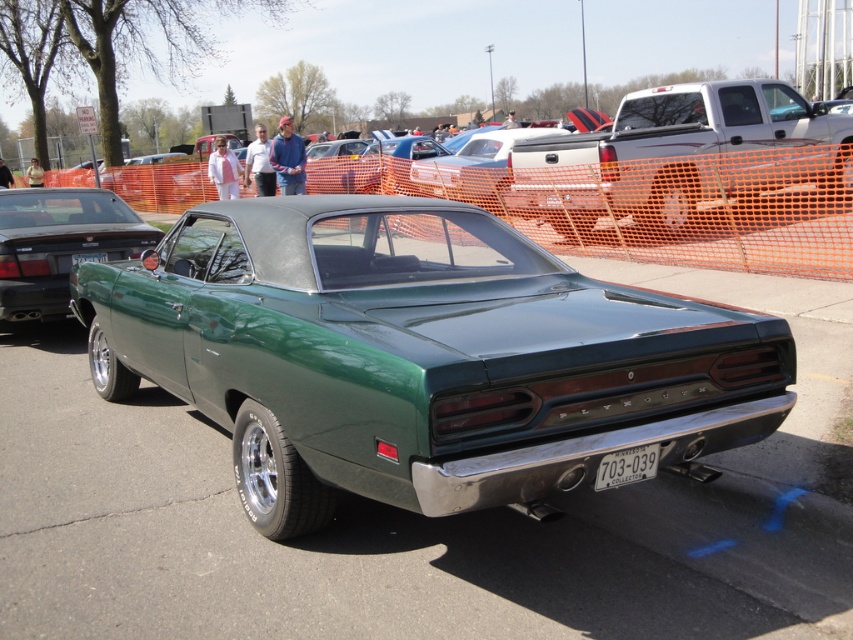
Between green glossy car at center and silver metallic pickup truck at upper right, which one has more height?

green glossy car at center

Which is above, green glossy car at center or silver metallic pickup truck at upper right?

silver metallic pickup truck at upper right is above.

Measure the distance between green glossy car at center and camera.

green glossy car at center is 8.52 feet away from camera.

The width and height of the screenshot is (853, 640). I want to click on green glossy car at center, so pos(418,355).

Does green glossy car at center lie behind green matte car at center?

No, it is in front of green matte car at center.

Image resolution: width=853 pixels, height=640 pixels. I want to click on green glossy car at center, so click(x=418, y=355).

Locate an element on the screen. The height and width of the screenshot is (640, 853). green glossy car at center is located at coordinates [x=418, y=355].

Where is `silver metallic pickup truck at upper right`? The height and width of the screenshot is (640, 853). silver metallic pickup truck at upper right is located at coordinates (682, 156).

Does silver metallic pickup truck at upper right have a lesser height compared to green matte car at center?

Correct, silver metallic pickup truck at upper right is not as tall as green matte car at center.

Between point (585, 164) and point (430, 188), which one is positioned in front?

Positioned in front is point (585, 164).

The height and width of the screenshot is (640, 853). What are the coordinates of `silver metallic pickup truck at upper right` in the screenshot? It's located at (682, 156).